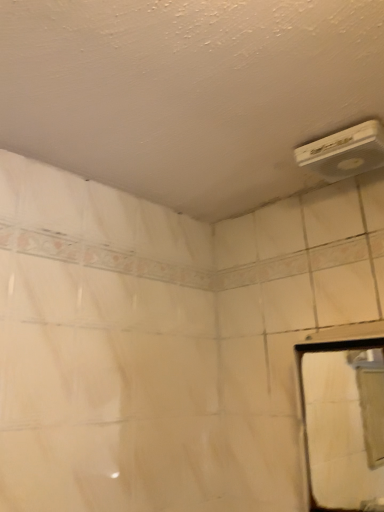
The width and height of the screenshot is (384, 512). Describe the element at coordinates (344, 426) in the screenshot. I see `white glossy mirror at right` at that location.

At what (x,y) coordinates should I click in order to perform the action: click on white glossy mirror at right. Please return your answer as a coordinate pair (x, y). The image size is (384, 512). Looking at the image, I should click on coord(344,426).

The width and height of the screenshot is (384, 512). Identify the location of white plastic air conditioning unit at upper right. (344, 152).

What do you see at coordinates (344, 152) in the screenshot?
I see `white plastic air conditioning unit at upper right` at bounding box center [344, 152].

Where is `white glossy mirror at right`? white glossy mirror at right is located at coordinates (344, 426).

Considering the relative positions of white glossy mirror at right and white plastic air conditioning unit at upper right in the image provided, is white glossy mirror at right to the right of white plastic air conditioning unit at upper right from the viewer's perspective?

Yes, white glossy mirror at right is to the right of white plastic air conditioning unit at upper right.

Who is more distant, white glossy mirror at right or white plastic air conditioning unit at upper right?

white plastic air conditioning unit at upper right is further away from the camera.

Is point (334, 371) behind point (340, 175)?

Yes, point (334, 371) is behind point (340, 175).

From the image's perspective, between white glossy mirror at right and white plastic air conditioning unit at upper right, which one is located above?

white plastic air conditioning unit at upper right appears higher in the image.

From a real-world perspective, is white glossy mirror at right on top of white plastic air conditioning unit at upper right?

No, from a real-world perspective, white glossy mirror at right is not on top of white plastic air conditioning unit at upper right.

Considering the relative sizes of white glossy mirror at right and white plastic air conditioning unit at upper right in the image provided, is white glossy mirror at right thinner than white plastic air conditioning unit at upper right?

Yes.

From their relative heights in the image, would you say white glossy mirror at right is taller or shorter than white plastic air conditioning unit at upper right?

Considering their sizes, white glossy mirror at right has more height than white plastic air conditioning unit at upper right.

Considering the sizes of objects white glossy mirror at right and white plastic air conditioning unit at upper right in the image provided, who is bigger, white glossy mirror at right or white plastic air conditioning unit at upper right?

white glossy mirror at right is bigger.

Is white plastic air conditioning unit at upper right inside white glossy mirror at right?

No, white plastic air conditioning unit at upper right is not surrounded by white glossy mirror at right.

Does white glossy mirror at right touch white plastic air conditioning unit at upper right?

No, white glossy mirror at right is not beside white plastic air conditioning unit at upper right.

Is white plastic air conditioning unit at upper right at the back of white glossy mirror at right?

white glossy mirror at right does not have its back to white plastic air conditioning unit at upper right.

How different are the orientations of white glossy mirror at right and white plastic air conditioning unit at upper right in degrees?

2.61 degrees.

This screenshot has width=384, height=512. In order to click on air conditioning located above the white glossy mirror at right (from the image's perspective) in this screenshot , I will do `click(344, 152)`.

Which is more to the left, white plastic air conditioning unit at upper right or white glossy mirror at right?

Positioned to the left is white plastic air conditioning unit at upper right.

Which object is closer to the camera taking this photo, white plastic air conditioning unit at upper right or white glossy mirror at right?

white glossy mirror at right is more forward.

Is point (345, 168) closer or farther from the camera than point (316, 419)?

Point (345, 168) appears to be closer to the viewer than point (316, 419).

From the image's perspective, between white plastic air conditioning unit at upper right and white glossy mirror at right, which one is located above?

white plastic air conditioning unit at upper right, from the image's perspective.

From a real-world perspective, is white plastic air conditioning unit at upper right above or below white glossy mirror at right?

Clearly, from a real-world perspective, white plastic air conditioning unit at upper right is above white glossy mirror at right.

Considering the relative sizes of white plastic air conditioning unit at upper right and white glossy mirror at right in the image provided, is white plastic air conditioning unit at upper right thinner than white glossy mirror at right?

No, white plastic air conditioning unit at upper right is not thinner than white glossy mirror at right.

From their relative heights in the image, would you say white plastic air conditioning unit at upper right is taller or shorter than white glossy mirror at right?

Clearly, white plastic air conditioning unit at upper right is shorter compared to white glossy mirror at right.

Can you confirm if white plastic air conditioning unit at upper right is smaller than white glossy mirror at right?

Indeed, white plastic air conditioning unit at upper right has a smaller size compared to white glossy mirror at right.

Would you say white plastic air conditioning unit at upper right is inside or outside white glossy mirror at right?

white plastic air conditioning unit at upper right is not enclosed by white glossy mirror at right.

Consider the image. Is white plastic air conditioning unit at upper right beside white glossy mirror at right?

No, white plastic air conditioning unit at upper right is not making contact with white glossy mirror at right.

Is white plastic air conditioning unit at upper right facing away from white glossy mirror at right?

That's not correct — white plastic air conditioning unit at upper right is not looking away from white glossy mirror at right.

How distant is white plastic air conditioning unit at upper right from white glossy mirror at right?

white plastic air conditioning unit at upper right is 3.42 feet from white glossy mirror at right.

This screenshot has width=384, height=512. In order to click on mirror in front of the white plastic air conditioning unit at upper right in this screenshot , I will do `click(344, 426)`.

The image size is (384, 512). What are the coordinates of `air conditioning behind the white glossy mirror at right` in the screenshot? It's located at (344, 152).

Where is `air conditioning to the left of white glossy mirror at right`? air conditioning to the left of white glossy mirror at right is located at coordinates (344, 152).